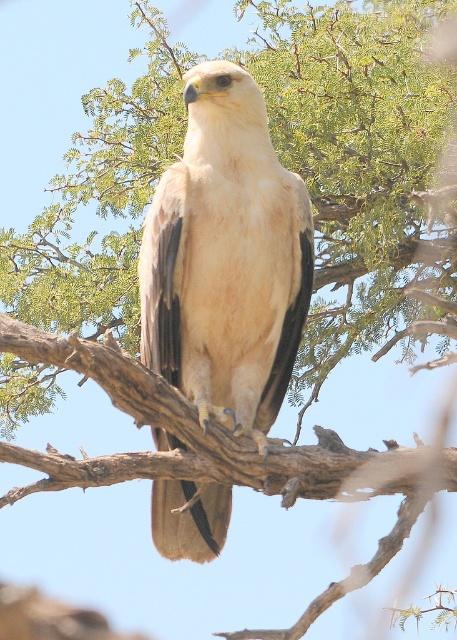
Does light brown feathered eagle at center have a larger size compared to brown rough tree branch at center?

No, light brown feathered eagle at center is not bigger than brown rough tree branch at center.

From the picture: Is light brown feathered eagle at center wider than brown rough tree branch at center?

No.

Does point (175, 179) lie behind point (286, 492)?

No, it is not.

I want to click on light brown feathered eagle at center, so click(x=227, y=259).